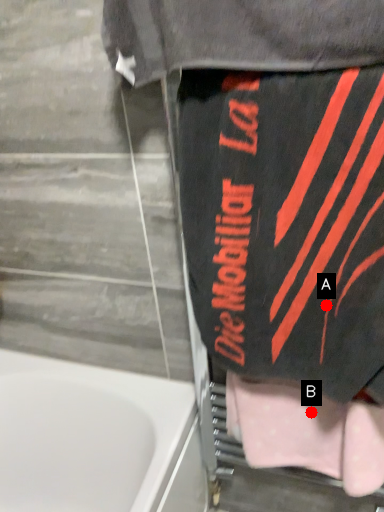
Question: Two points are circled on the image, labeled by A and B beside each circle. Which point is farther from the camera taking this photo?

Choices:
 (A) A is further
 (B) B is further

Answer: (B)